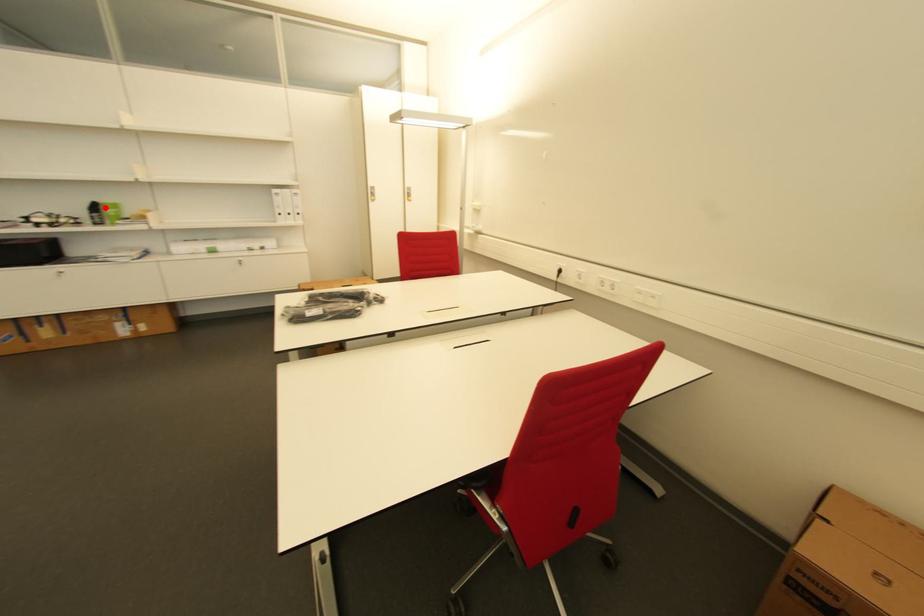
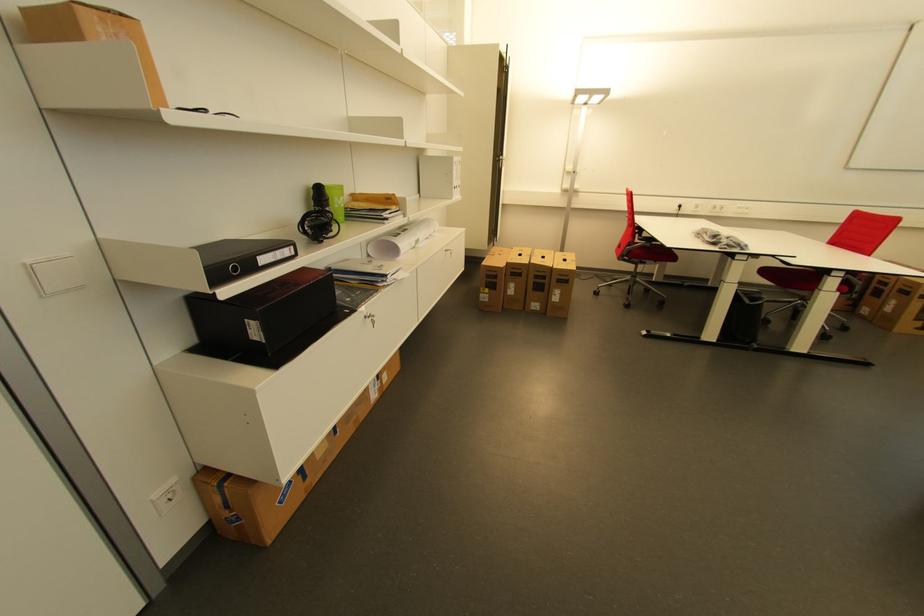
The point at the highlighted location is marked in the first image. Where is the corresponding point in the second image?

(333, 193)